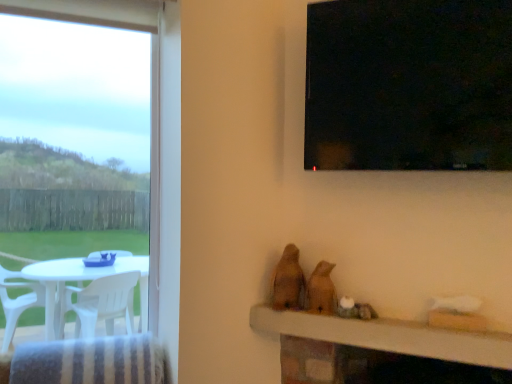
Question: From a real-world perspective, does transparent glass window at upper right stand above brown matte bird at center, the 2th animal when ordered from left to right?

Choices:
 (A) no
 (B) yes

Answer: (B)

Question: Is brown matte bird at center, the first animal from the right, completely or partially inside transparent glass window at upper right?

Choices:
 (A) yes
 (B) no

Answer: (B)

Question: Is transparent glass window at upper right at the right side of brown matte bird at center, the first animal from the right?

Choices:
 (A) yes
 (B) no

Answer: (A)

Question: From a real-world perspective, is transparent glass window at upper right beneath brown matte bird at center, the 2th animal when ordered from left to right?

Choices:
 (A) no
 (B) yes

Answer: (A)

Question: Is transparent glass window at upper right oriented away from brown matte bird at center, the first animal from the right?

Choices:
 (A) yes
 (B) no

Answer: (B)

Question: Is transparent glass window at upper right not near brown matte bird at center, the 2th animal when ordered from left to right?

Choices:
 (A) no
 (B) yes

Answer: (A)

Question: Are brown matte bird at center, the first animal from the right, and wooden table at lower center far apart?

Choices:
 (A) no
 (B) yes

Answer: (A)

Question: Is brown matte bird at center, the first animal from the right, behind wooden table at lower center?

Choices:
 (A) yes
 (B) no

Answer: (A)

Question: From the image's perspective, would you say brown matte bird at center, the first animal from the right, is positioned over wooden table at lower center?

Choices:
 (A) no
 (B) yes

Answer: (B)

Question: Is brown matte bird at center, the 2th animal when ordered from left to right, positioned before wooden table at lower center?

Choices:
 (A) no
 (B) yes

Answer: (A)

Question: Considering the relative sizes of brown matte bird at center, the 2th animal when ordered from left to right, and wooden table at lower center in the image provided, is brown matte bird at center, the 2th animal when ordered from left to right, smaller than wooden table at lower center?

Choices:
 (A) yes
 (B) no

Answer: (A)

Question: From a real-world perspective, is brown matte bird at center, the 2th animal when ordered from left to right, positioned under wooden table at lower center based on gravity?

Choices:
 (A) yes
 (B) no

Answer: (B)

Question: From a real-world perspective, is brown matte bird at center, the 2th animal when ordered from left to right, physically below brown matte bird at center, which ranks as the second animal in right-to-left order?

Choices:
 (A) yes
 (B) no

Answer: (A)